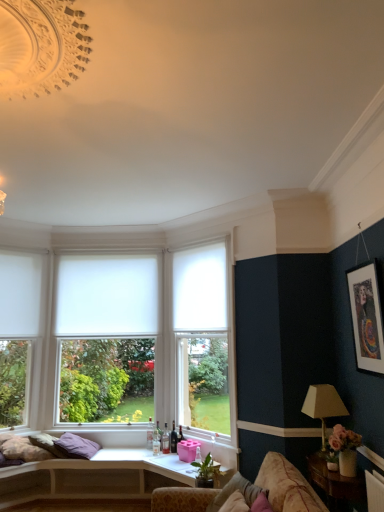
Question: Is white matte window at center, arranged as the third window when viewed from the left, thinner than purple fabric pillow at lower left, placed as the second pillow when sorted from right to left?

Choices:
 (A) yes
 (B) no

Answer: (A)

Question: From the image's perspective, is white matte window at center, arranged as the 1th window when viewed from the right, under purple fabric pillow at lower left, placed as the second pillow when sorted from right to left?

Choices:
 (A) no
 (B) yes

Answer: (A)

Question: Considering the relative sizes of white matte window at center, arranged as the 1th window when viewed from the right, and purple fabric pillow at lower left, placed as the second pillow when sorted from right to left, in the image provided, is white matte window at center, arranged as the 1th window when viewed from the right, wider than purple fabric pillow at lower left, placed as the second pillow when sorted from right to left,?

Choices:
 (A) no
 (B) yes

Answer: (A)

Question: Considering the relative positions of white matte window at center, arranged as the 1th window when viewed from the right, and purple fabric pillow at lower left, acting as the 1th pillow starting from the back, in the image provided, is white matte window at center, arranged as the 1th window when viewed from the right, to the left of purple fabric pillow at lower left, acting as the 1th pillow starting from the back, from the viewer's perspective?

Choices:
 (A) yes
 (B) no

Answer: (B)

Question: Considering the relative sizes of white matte window at center, arranged as the third window when viewed from the left, and purple fabric pillow at lower left, marked as the first pillow in a bottom-to-top arrangement, in the image provided, is white matte window at center, arranged as the third window when viewed from the left, taller than purple fabric pillow at lower left, marked as the first pillow in a bottom-to-top arrangement,?

Choices:
 (A) no
 (B) yes

Answer: (B)

Question: Is point (364, 275) positioned closer to the camera than point (352, 479)?

Choices:
 (A) closer
 (B) farther

Answer: (B)

Question: Based on their positions, is matte black picture frame at upper right located to the left or right of wooden side table at lower right?

Choices:
 (A) left
 (B) right

Answer: (B)

Question: From the image's perspective, is matte black picture frame at upper right above or below wooden side table at lower right?

Choices:
 (A) below
 (B) above

Answer: (B)

Question: Which is correct: matte black picture frame at upper right is inside wooden side table at lower right, or outside of it?

Choices:
 (A) inside
 (B) outside

Answer: (B)

Question: Is point (243, 484) positioned closer to the camera than point (220, 344)?

Choices:
 (A) farther
 (B) closer

Answer: (B)

Question: Considering the positions of pink fabric pillow at lower right, which is counted as the second pillow, starting from the back, and white matte window at center, arranged as the third window when viewed from the left, in the image, is pink fabric pillow at lower right, which is counted as the second pillow, starting from the back, bigger or smaller than white matte window at center, arranged as the third window when viewed from the left,?

Choices:
 (A) big
 (B) small

Answer: (B)

Question: From the image's perspective, relative to white matte window at center, arranged as the 1th window when viewed from the right, is pink fabric pillow at lower right, which is the 2th pillow from bottom to top, above or below?

Choices:
 (A) below
 (B) above

Answer: (A)

Question: Would you say pink fabric pillow at lower right, placed as the 1th pillow when sorted from top to bottom, is to the left or to the right of white matte window at center, arranged as the third window when viewed from the left, in the picture?

Choices:
 (A) left
 (B) right

Answer: (B)

Question: From their relative heights in the image, would you say wooden side table at lower right is taller or shorter than white matte curtain at left, which is the first curtain in left-to-right order?

Choices:
 (A) tall
 (B) short

Answer: (B)

Question: Does point (324, 489) appear closer or farther from the camera than point (18, 315)?

Choices:
 (A) farther
 (B) closer

Answer: (B)